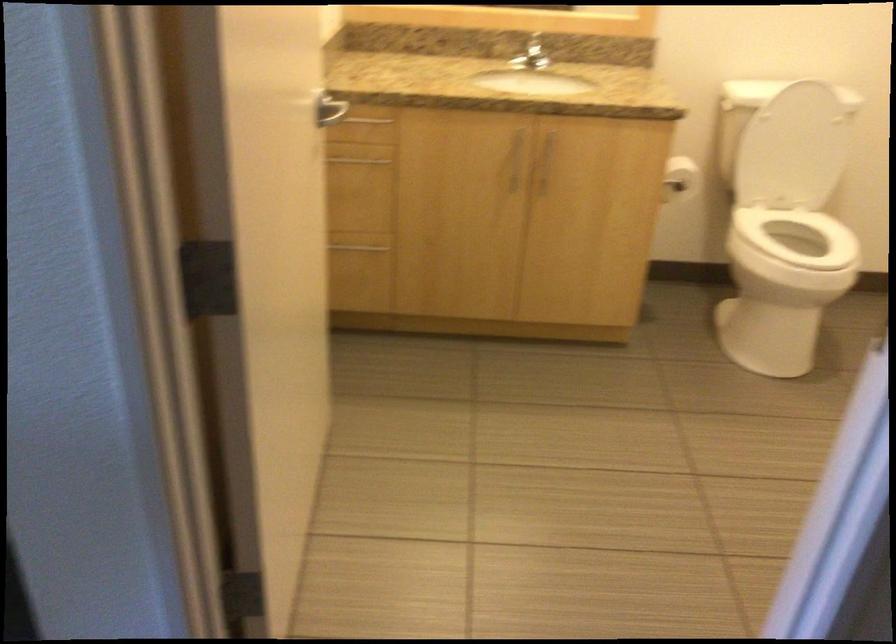
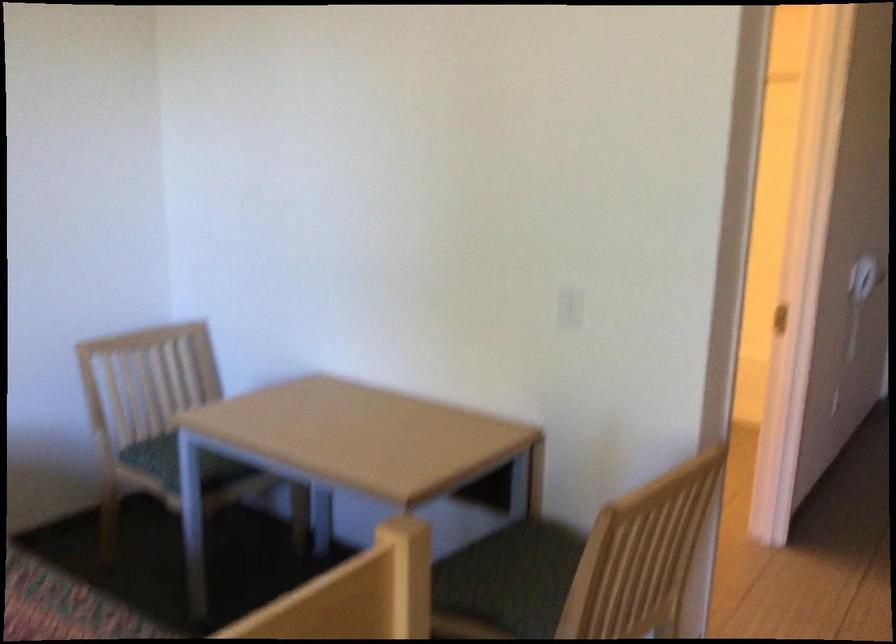
Question: I am providing you with two images of the same scene from different viewpoints. Please identify which objects are invisible in image2.

Choices:
 (A) white electrical outlet
 (B) chair sitting surface
 (C) beige curtain
 (D) cabinet handle

Answer: (D)